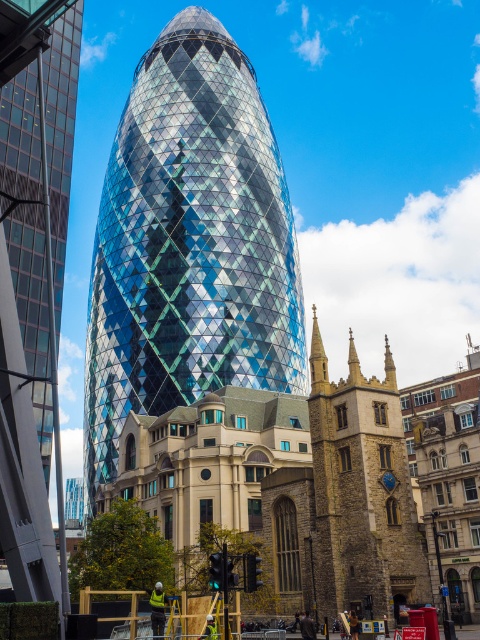
Question: Is shiny glass tower at center positioned before shiny glass skyscraper at center?

Choices:
 (A) no
 (B) yes

Answer: (A)

Question: Does shiny glass tower at center appear under shiny glass skyscraper at center?

Choices:
 (A) yes
 (B) no

Answer: (B)

Question: Where is shiny glass tower at center located in relation to shiny glass skyscraper at center in the image?

Choices:
 (A) right
 (B) left

Answer: (A)

Question: Which object is closer to the camera taking this photo?

Choices:
 (A) shiny glass skyscraper at center
 (B) shiny glass tower at center

Answer: (A)